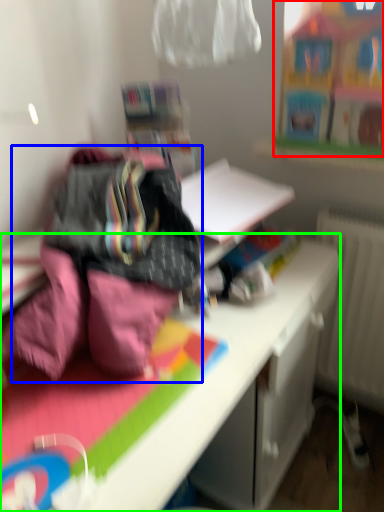
Question: Which object is the farthest from toy (highlighted by a red box)? Choose among these: bedding (highlighted by a blue box) or desk (highlighted by a green box).

Choices:
 (A) bedding
 (B) desk

Answer: (A)